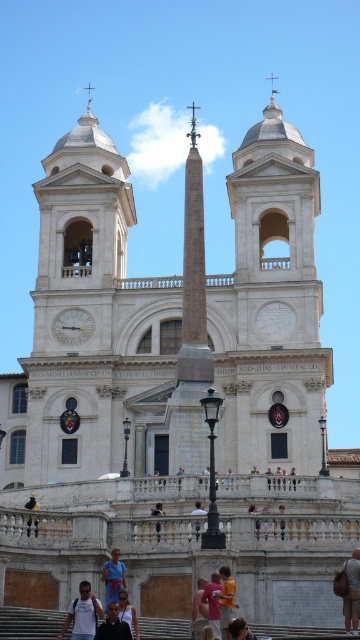
Question: Which object is farther from the camera taking this photo?

Choices:
 (A) brown hair at lower center
 (B) white fabric at center
 (C) dark blue jeans at lower left

Answer: (B)

Question: Does light blue denim jeans at lower center have a smaller size compared to white fabric at center?

Choices:
 (A) no
 (B) yes

Answer: (A)

Question: Which of these objects is positioned closest to the brown hair at lower center?

Choices:
 (A) white cotton shirt at lower center
 (B) denim jacket at lower right
 (C) dark blue shirt at lower center

Answer: (C)

Question: Among these points, which one is nearest to the camera?

Choices:
 (A) (348, 600)
 (B) (150, 509)

Answer: (A)

Question: Where is dark blue shirt at lower center located in relation to brown hair at lower center in the image?

Choices:
 (A) above
 (B) below

Answer: (B)

Question: Can you confirm if brown hair at lower center is wider than light blue denim jeans at lower center?

Choices:
 (A) no
 (B) yes

Answer: (B)